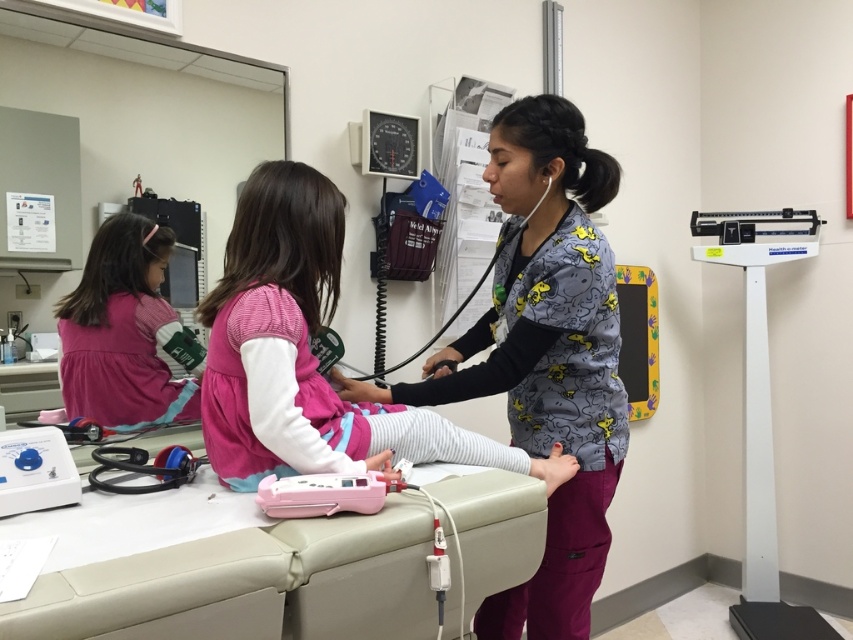
You are a patient entering the examination room and see the gray printed scrubs at center and the pink fabric dress at center. Which clothing item is located to the right when facing the healthcare professional?

The gray printed scrubs at center is positioned on the right side of pink fabric dress at center, so when facing the healthcare professional, the gray printed scrubs at center is to the right of the pink fabric dress at center.

Consider the image. You are a medical student observing the healthcare professional in the examination room. Where is the gray printed scrubs at center positioned relative to the counter on the left side of the room?

The gray printed scrubs at center is located at point (544,355), which is near the center of the room, closer to the examination table than the counter on the left side.

You are a patient entering the examination room and see the gray printed scrubs at center and the pink fabric dress at center. Which clothing item is bigger in size?

The gray printed scrubs at center is larger in size compared to the pink fabric dress at center.